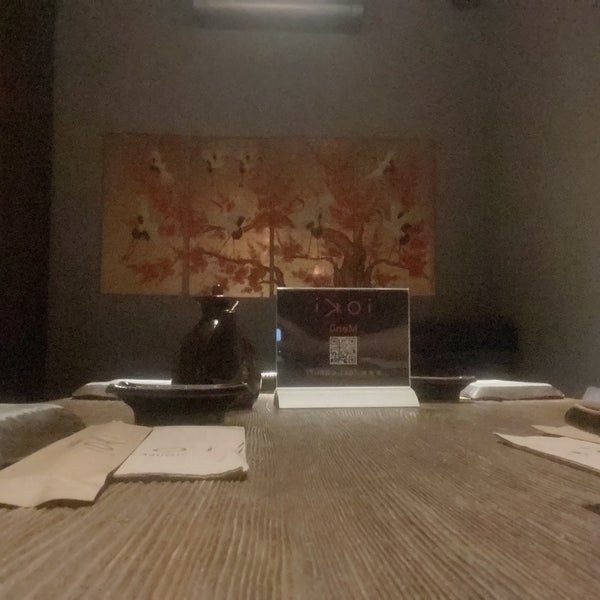
Where is `framed painting`? framed painting is located at coordinates (268, 219).